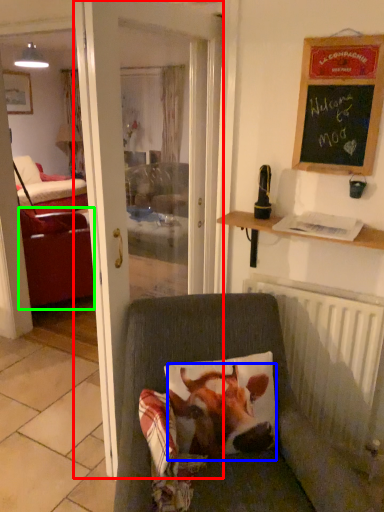
Question: Based on their relative distances, which object is nearer to door (highlighted by a red box)? Choose from cattle (highlighted by a blue box) and studio couch (highlighted by a green box).

Choices:
 (A) cattle
 (B) studio couch

Answer: (A)